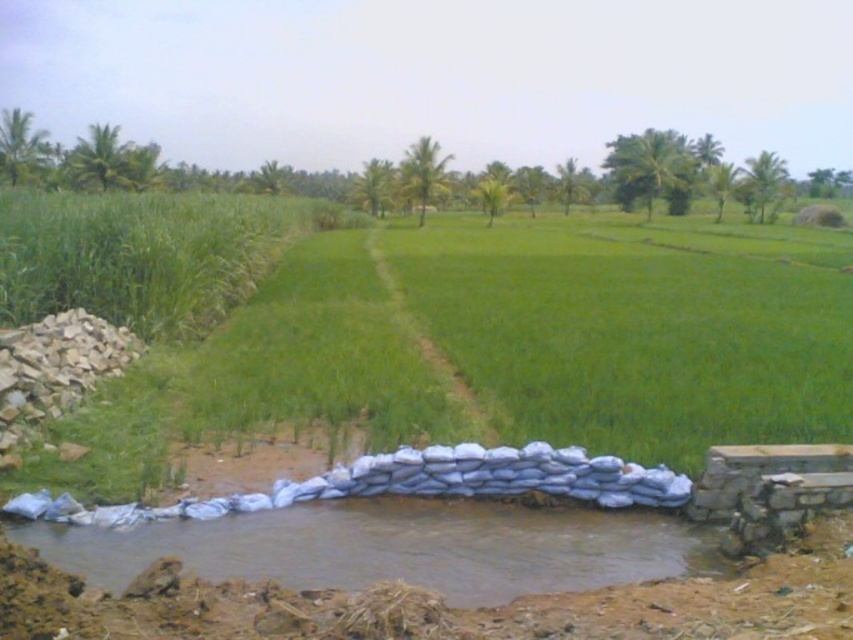
You are a farmer checking the water level in the waterway. You see the green grass at center and the brown clay water at lower left. Which object is taller?

The green grass at center is much taller than the brown clay water at lower left.

You are standing at the point marked by the coordinates point (500, 348) in the image. What is the immediate terrain type under your feet?

The point (500, 348) corresponds to green grass at center, so the immediate terrain type under your feet is green grass.